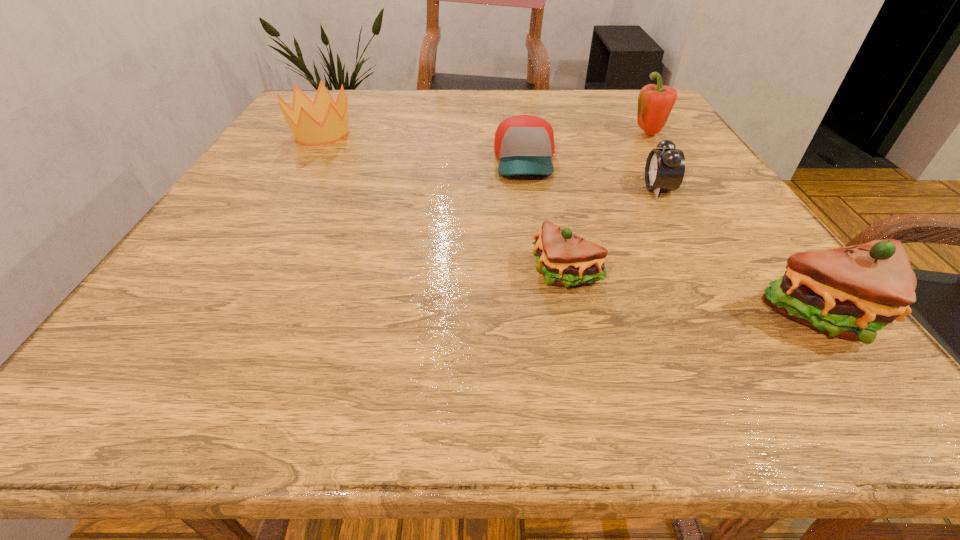
Identify the location of free area in between the alarm clock and the baseball cap. (591, 174).

Locate an element on the screen. The image size is (960, 540). vacant space in between the baseball cap and the alarm clock is located at coordinates (591, 174).

The height and width of the screenshot is (540, 960). In order to click on free area in between the alarm clock and the baseball cap in this screenshot , I will do `click(591, 174)`.

Where is `vacant space in between the crown and the baseball cap`? vacant space in between the crown and the baseball cap is located at coordinates (423, 147).

Where is `vacant area that lies between the shorter sandwich and the taller sandwich`? The image size is (960, 540). vacant area that lies between the shorter sandwich and the taller sandwich is located at coordinates (695, 295).

Locate an element on the screen. This screenshot has height=540, width=960. empty space that is in between the pepper and the left sandwich is located at coordinates (607, 204).

You are a GUI agent. You are given a task and a screenshot of the screen. Output one action in this format:
    pyautogui.click(x=<x>, y=<y>)
    Task: Click on the vacant space that's between the left sandwich and the right sandwich
    The width and height of the screenshot is (960, 540).
    Given the screenshot: What is the action you would take?
    pyautogui.click(x=695, y=295)

I want to click on free spot between the shorter sandwich and the leftmost object, so click(444, 203).

The image size is (960, 540). I want to click on object that can be found as the second closest to the shorter sandwich, so coord(524,144).

Select which object is the second closest to the pepper. Please provide its 2D coordinates. Your answer should be formatted as a tuple, i.e. [(x, y)], where the tuple contains the x and y coordinates of a point satisfying the conditions above.

[(524, 144)]